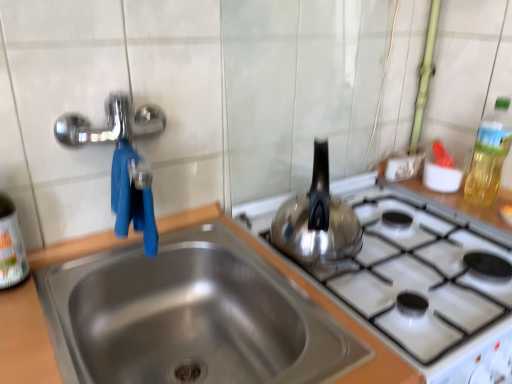
Find the location of a particular element. This screenshot has width=512, height=384. shiny metallic kettle at right is located at coordinates (317, 219).

What are the coordinates of `stainless steel sink at center` in the screenshot? It's located at (179, 293).

Which object is positioned more to the left, stainless steel sink at center or white plastic bottle at left, which ranks as the 1th bottle in left-to-right order?

white plastic bottle at left, which ranks as the 1th bottle in left-to-right order, is more to the left.

Is stainless steel sink at center turned away from white plastic bottle at left, which appears as the 2th bottle when viewed from the back?

stainless steel sink at center does not have its back to white plastic bottle at left, which appears as the 2th bottle when viewed from the back.

Between stainless steel sink at center and white plastic bottle at left, which ranks as the 1th bottle in left-to-right order, which one has larger width?

stainless steel sink at center is wider.

Is stainless steel sink at center located outside white plastic bottle at left, acting as the second bottle starting from the right?

Yes, stainless steel sink at center is outside of white plastic bottle at left, acting as the second bottle starting from the right.

Could you tell me if white plastic bottle at left, acting as the second bottle starting from the right, is facing stainless steel sink at center?

No.

Considering the relative sizes of white plastic bottle at left, which appears as the 2th bottle when viewed from the back, and stainless steel sink at center in the image provided, is white plastic bottle at left, which appears as the 2th bottle when viewed from the back, wider than stainless steel sink at center?

No.

Based on the photo, how many degrees apart are the facing directions of white plastic bottle at left, which appears as the 2th bottle when viewed from the back, and stainless steel sink at center?

There is a 0.833-degree angle between the facing directions of white plastic bottle at left, which appears as the 2th bottle when viewed from the back, and stainless steel sink at center.

Between white plastic bottle at left, the 1th bottle in the front-to-back sequence, and stainless steel sink at center, which one has smaller size?

With smaller size is white plastic bottle at left, the 1th bottle in the front-to-back sequence.

Considering the sizes of objects stainless steel sink at center and translucent yellow bottle at upper right, which is the 2th bottle in left-to-right order, in the image provided, who is bigger, stainless steel sink at center or translucent yellow bottle at upper right, which is the 2th bottle in left-to-right order,?

With larger size is stainless steel sink at center.

Is the depth of stainless steel sink at center greater than that of translucent yellow bottle at upper right, which is the 2th bottle in left-to-right order?

No, stainless steel sink at center is closer to the camera.

From a real-world perspective, is stainless steel sink at center located beneath translucent yellow bottle at upper right, placed as the 1th bottle when sorted from right to left?

Yes.

Consider the image. From the image's perspective, which object appears higher, stainless steel sink at center or translucent yellow bottle at upper right, placed as the 1th bottle when sorted from right to left?

translucent yellow bottle at upper right, placed as the 1th bottle when sorted from right to left.

Is translucent yellow bottle at upper right, placed as the 1th bottle when sorted from right to left, inside or outside of shiny metallic kettle at right?

translucent yellow bottle at upper right, placed as the 1th bottle when sorted from right to left, exists outside the volume of shiny metallic kettle at right.

Considering the sizes of objects translucent yellow bottle at upper right, placed as the 1th bottle when sorted from right to left, and shiny metallic kettle at right in the image provided, who is shorter, translucent yellow bottle at upper right, placed as the 1th bottle when sorted from right to left, or shiny metallic kettle at right?

Standing shorter between the two is shiny metallic kettle at right.

Who is bigger, translucent yellow bottle at upper right, arranged as the 1th bottle when viewed from the back, or shiny metallic kettle at right?

shiny metallic kettle at right is bigger.

From a real-world perspective, is translucent yellow bottle at upper right, arranged as the 1th bottle when viewed from the back, beneath white plastic bottle at left, which appears as the 2th bottle when viewed from the back?

No, from a real-world perspective, translucent yellow bottle at upper right, arranged as the 1th bottle when viewed from the back, is not under white plastic bottle at left, which appears as the 2th bottle when viewed from the back.

Based on the photo, is translucent yellow bottle at upper right, arranged as the 1th bottle when viewed from the back, wider than white plastic bottle at left, the 1th bottle in the front-to-back sequence?

No.

Does translucent yellow bottle at upper right, which is the 2th bottle in left-to-right order, have a smaller size compared to white plastic bottle at left, acting as the second bottle starting from the right?

Incorrect, translucent yellow bottle at upper right, which is the 2th bottle in left-to-right order, is not smaller in size than white plastic bottle at left, acting as the second bottle starting from the right.

Is translucent yellow bottle at upper right, placed as the 1th bottle when sorted from right to left, completely or partially outside of white plastic bottle at left, which appears as the 2th bottle when viewed from the back?

Yes, translucent yellow bottle at upper right, placed as the 1th bottle when sorted from right to left, is not within white plastic bottle at left, which appears as the 2th bottle when viewed from the back.

Is white plastic bottle at left, the 1th bottle in the front-to-back sequence, smaller than translucent yellow bottle at upper right, arranged as the 1th bottle when viewed from the back?

Correct, white plastic bottle at left, the 1th bottle in the front-to-back sequence, occupies less space than translucent yellow bottle at upper right, arranged as the 1th bottle when viewed from the back.

From the image's perspective, relative to translucent yellow bottle at upper right, placed as the 1th bottle when sorted from right to left, is white plastic bottle at left, acting as the second bottle starting from the right, above or below?

white plastic bottle at left, acting as the second bottle starting from the right, is below translucent yellow bottle at upper right, placed as the 1th bottle when sorted from right to left.

Is white plastic bottle at left, the 1th bottle in the front-to-back sequence, positioned far away from translucent yellow bottle at upper right, the second bottle when ordered from front to back?

Indeed, white plastic bottle at left, the 1th bottle in the front-to-back sequence, is not near translucent yellow bottle at upper right, the second bottle when ordered from front to back.

Locate an element on the screen. This screenshot has width=512, height=384. tea pot that appears behind the white plastic bottle at left, acting as the second bottle starting from the right is located at coordinates (317, 219).

Is white plastic bottle at left, acting as the second bottle starting from the right, thinner than shiny metallic kettle at right?

Yes, white plastic bottle at left, acting as the second bottle starting from the right, is thinner than shiny metallic kettle at right.

Based on the photo, does white plastic bottle at left, the 1th bottle in the front-to-back sequence, turn towards shiny metallic kettle at right?

No, white plastic bottle at left, the 1th bottle in the front-to-back sequence, does not turn towards shiny metallic kettle at right.

Which object is further away from the camera taking this photo, white plastic bottle at left, the 1th bottle in the front-to-back sequence, or shiny metallic kettle at right?

shiny metallic kettle at right is more distant.

I want to click on the 1st bottle above the stainless steel sink at center (from the image's perspective), so click(11, 246).

The image size is (512, 384). What are the coordinates of `the 1st bottle behind the stainless steel sink at center, counting from the anchor's position` in the screenshot? It's located at (11, 246).

Which object lies nearer to the anchor point white plastic bottle at left, which appears as the 2th bottle when viewed from the back, shiny metallic kettle at right or stainless steel sink at center?

Based on the image, stainless steel sink at center appears to be nearer to white plastic bottle at left, which appears as the 2th bottle when viewed from the back.

Considering their positions, is translucent yellow bottle at upper right, which is the 2th bottle in left-to-right order, positioned further to white plastic bottle at left, the 1th bottle in the front-to-back sequence, than stainless steel sink at center?

translucent yellow bottle at upper right, which is the 2th bottle in left-to-right order, lies further to white plastic bottle at left, the 1th bottle in the front-to-back sequence, than the other object.

Estimate the real-world distances between objects in this image. Which object is closer to white plastic bottle at left, which ranks as the 1th bottle in left-to-right order, stainless steel sink at center or translucent yellow bottle at upper right, the second bottle when ordered from front to back?

stainless steel sink at center is positioned closer to the anchor white plastic bottle at left, which ranks as the 1th bottle in left-to-right order.

From the image, which object appears to be farther from shiny metallic kettle at right, white plastic bottle at left, acting as the second bottle starting from the right, or stainless steel sink at center?

white plastic bottle at left, acting as the second bottle starting from the right, lies further to shiny metallic kettle at right than the other object.

Which object lies nearer to the anchor point shiny metallic kettle at right, translucent yellow bottle at upper right, the second bottle when ordered from front to back, or white plastic bottle at left, the 1th bottle in the front-to-back sequence?

The object closer to shiny metallic kettle at right is translucent yellow bottle at upper right, the second bottle when ordered from front to back.

When comparing their distances from translucent yellow bottle at upper right, which is the 2th bottle in left-to-right order, does white plastic bottle at left, acting as the second bottle starting from the right, or stainless steel sink at center seem closer?

The object closer to translucent yellow bottle at upper right, which is the 2th bottle in left-to-right order, is stainless steel sink at center.

Looking at the image, which one is located further to shiny metallic kettle at right, stainless steel sink at center or white plastic bottle at left, which appears as the 2th bottle when viewed from the back?

white plastic bottle at left, which appears as the 2th bottle when viewed from the back, lies further to shiny metallic kettle at right than the other object.

Estimate the real-world distances between objects in this image. Which object is further from white plastic bottle at left, which ranks as the 1th bottle in left-to-right order, stainless steel sink at center or shiny metallic kettle at right?

The object further to white plastic bottle at left, which ranks as the 1th bottle in left-to-right order, is shiny metallic kettle at right.

I want to click on sink located between white plastic bottle at left, which appears as the 2th bottle when viewed from the back, and translucent yellow bottle at upper right, the second bottle when ordered from front to back, in the left-right direction, so click(179, 293).

You are a GUI agent. You are given a task and a screenshot of the screen. Output one action in this format:
    pyautogui.click(x=<x>, y=<y>)
    Task: Click on the tea pot located between stainless steel sink at center and translucent yellow bottle at upper right, arranged as the 1th bottle when viewed from the back, in the left-right direction
    The image size is (512, 384).
    Given the screenshot: What is the action you would take?
    (317, 219)

Identify the location of sink between white plastic bottle at left, which ranks as the 1th bottle in left-to-right order, and shiny metallic kettle at right from left to right. (179, 293).

Find the location of `tea pot situated between white plastic bottle at left, which appears as the 2th bottle when viewed from the back, and translucent yellow bottle at upper right, arranged as the 1th bottle when viewed from the back, from left to right`. tea pot situated between white plastic bottle at left, which appears as the 2th bottle when viewed from the back, and translucent yellow bottle at upper right, arranged as the 1th bottle when viewed from the back, from left to right is located at coordinates (317, 219).